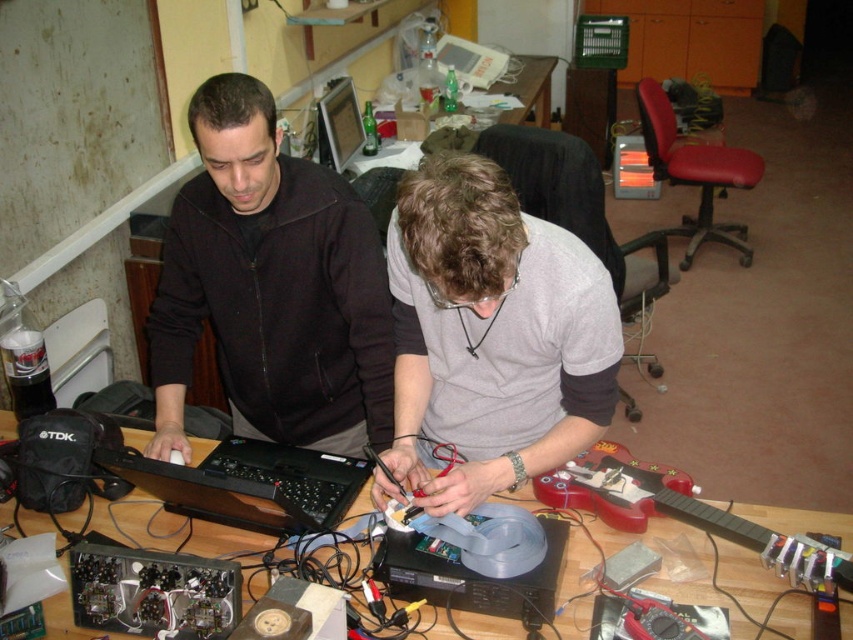
Does gray matte shirt at center appear under wooden table at center?

Incorrect, gray matte shirt at center is not positioned below wooden table at center.

Is gray matte shirt at center thinner than wooden table at center?

Indeed, gray matte shirt at center has a lesser width compared to wooden table at center.

Describe the element at coordinates (491, 337) in the screenshot. The width and height of the screenshot is (853, 640). I see `gray matte shirt at center` at that location.

You are a GUI agent. You are given a task and a screenshot of the screen. Output one action in this format:
    pyautogui.click(x=<x>, y=<y>)
    Task: Click on the gray matte shirt at center
    The width and height of the screenshot is (853, 640).
    Given the screenshot: What is the action you would take?
    pyautogui.click(x=491, y=337)

You are a GUI agent. You are given a task and a screenshot of the screen. Output one action in this format:
    pyautogui.click(x=<x>, y=<y>)
    Task: Click on the black matte jacket at upper left
    The height and width of the screenshot is (640, 853).
    Given the screenshot: What is the action you would take?
    pyautogui.click(x=270, y=288)

Does black matte jacket at upper left appear over wooden table at center?

Indeed, black matte jacket at upper left is positioned over wooden table at center.

Which is in front, point (254, 296) or point (840, 608)?

Positioned in front is point (840, 608).

Image resolution: width=853 pixels, height=640 pixels. Identify the location of black matte jacket at upper left. (270, 288).

Who is positioned more to the right, black matte jacket at upper left or gray matte shirt at center?

From the viewer's perspective, gray matte shirt at center appears more on the right side.

Is black matte jacket at upper left bigger than gray matte shirt at center?

Correct, black matte jacket at upper left is larger in size than gray matte shirt at center.

Is point (286, 182) positioned before point (459, 474)?

No, it is behind (459, 474).

In order to click on black matte jacket at upper left in this screenshot , I will do `click(270, 288)`.